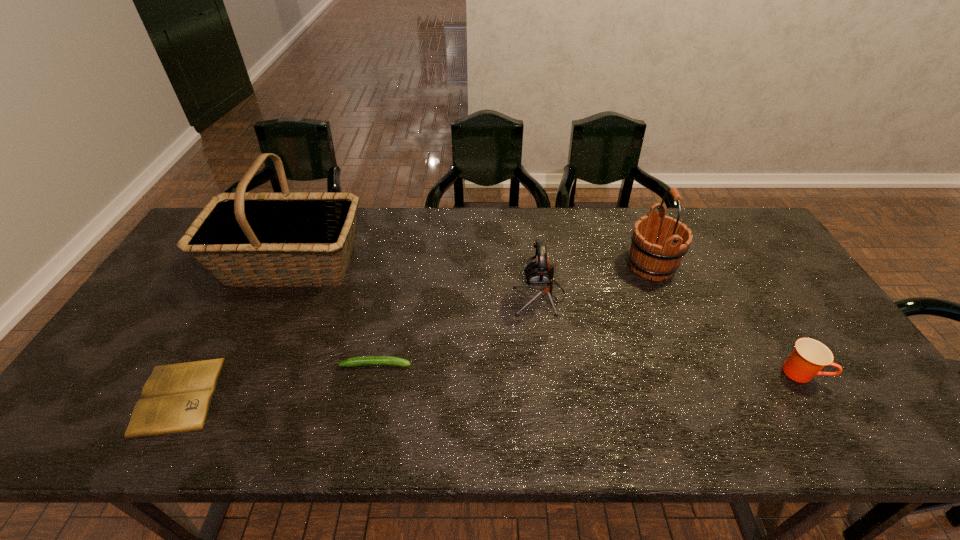
Where is `the tallest object`? the tallest object is located at coordinates (225, 239).

This screenshot has height=540, width=960. I want to click on the second object from right to left, so click(659, 243).

What are the coordinates of `the fifth shortest object` in the screenshot? It's located at (659, 243).

I want to click on the fourth shortest object, so click(539, 274).

Locate an element on the screen. This screenshot has width=960, height=540. the third object from right to left is located at coordinates (539, 274).

Locate an element on the screen. This screenshot has width=960, height=540. cup is located at coordinates (809, 356).

This screenshot has height=540, width=960. Identify the location of the third shortest object. (809, 356).

Identify the location of the third object from left to right. The height and width of the screenshot is (540, 960). (363, 360).

Find the location of a particular element. Image resolution: width=960 pixels, height=540 pixels. zucchini is located at coordinates (363, 360).

Identify the location of the shortest object. (176, 398).